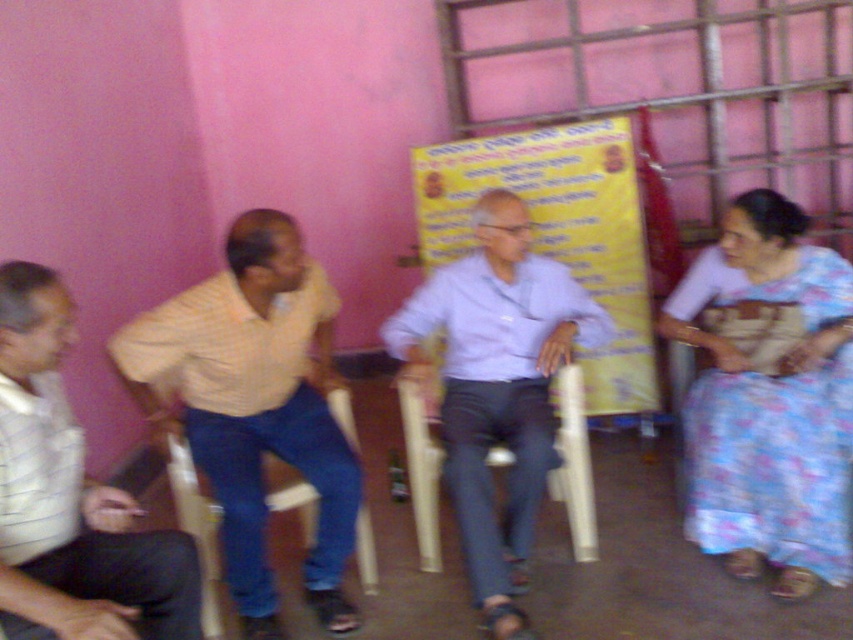
Who is higher up, light yellow shirt at left or wooden at center?

Positioned higher is light yellow shirt at left.

Can you confirm if light yellow shirt at left is smaller than wooden at center?

No, light yellow shirt at left is not smaller than wooden at center.

Identify the location of light yellow shirt at left. (254, 404).

At what (x,y) coordinates should I click in order to perform the action: click on light yellow shirt at left. Please return your answer as a coordinate pair (x, y). Looking at the image, I should click on (254, 404).

Does point (288, 378) come in front of point (357, 449)?

Yes.

Image resolution: width=853 pixels, height=640 pixels. Identify the location of light yellow shirt at left. (254, 404).

The width and height of the screenshot is (853, 640). Find the location of `light yellow shirt at left`. light yellow shirt at left is located at coordinates (254, 404).

Can you confirm if light yellow shirt at left is wider than white striped shirt at left?

Yes.

Which is more to the right, light yellow shirt at left or white striped shirt at left?

light yellow shirt at left is more to the right.

Is point (316, 419) farther from viewer compared to point (97, 596)?

That is True.

The width and height of the screenshot is (853, 640). I want to click on light yellow shirt at left, so click(254, 404).